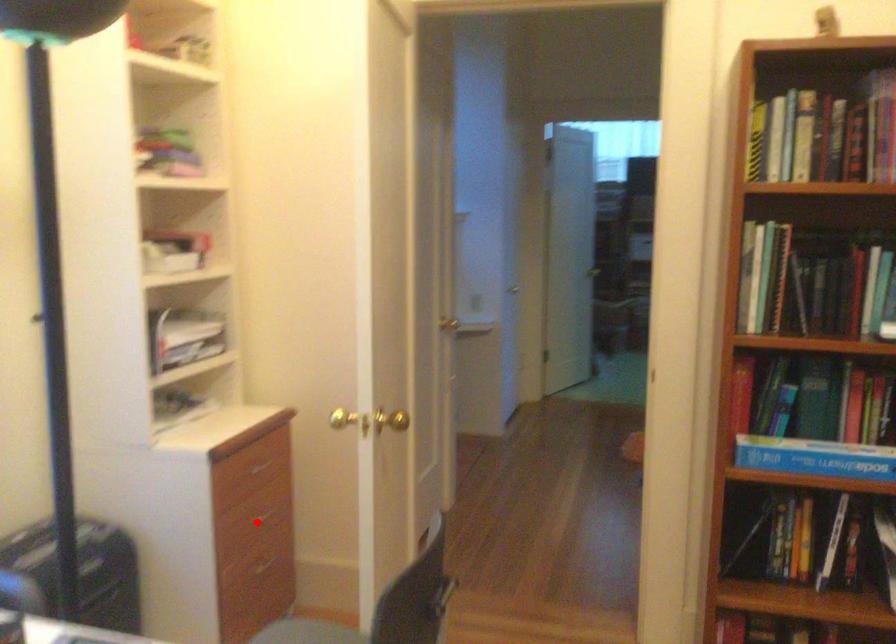
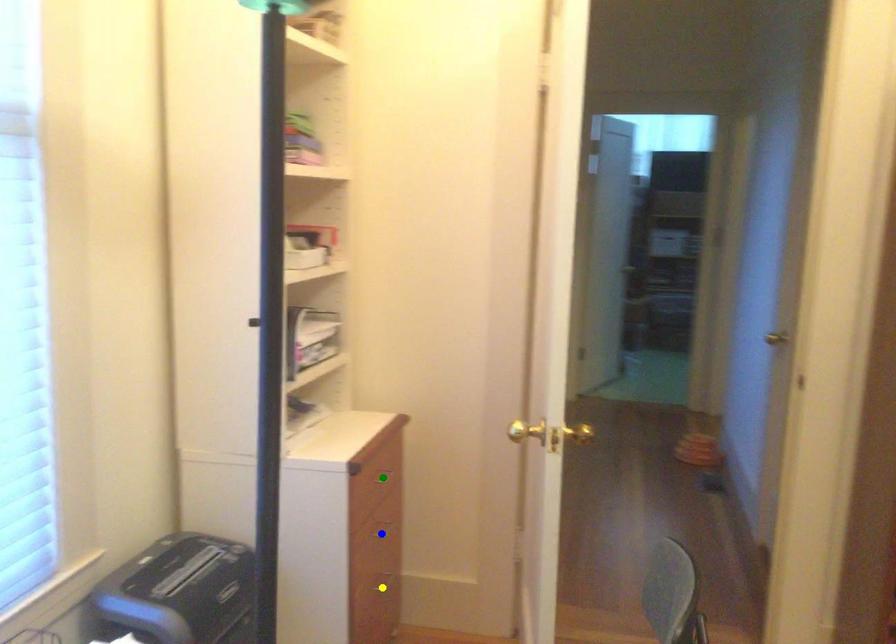
Question: I am providing you with two images of the same scene from different viewpoints. A red point is marked on the first image. You are given multiple points on the second image. Which point in image 2 is actually the same real-world point as the red point in image 1?

Choices:
 (A) blue point
 (B) green point
 (C) yellow point

Answer: (A)